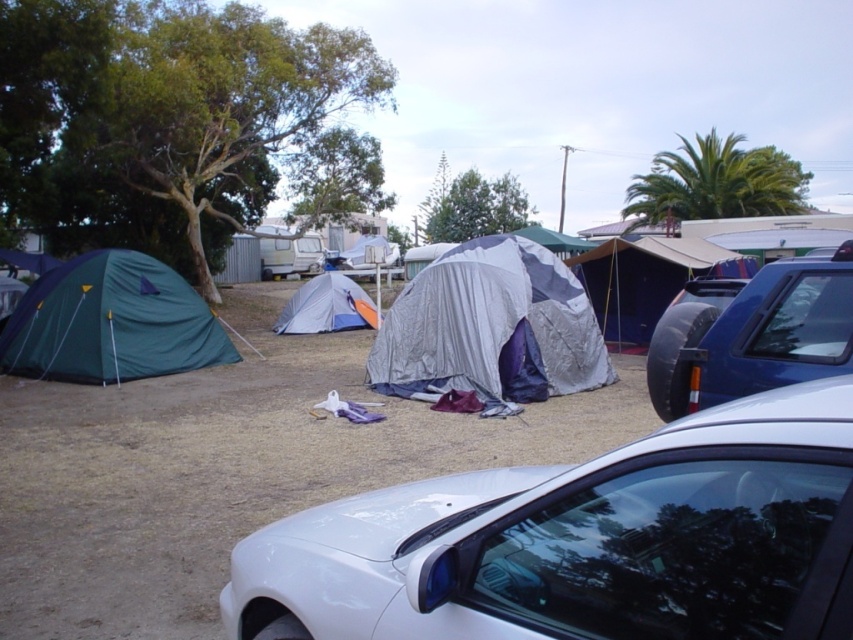
From the picture: Is green fabric tent at lower left to the right of blue metallic car at right from the viewer's perspective?

No, green fabric tent at lower left is not to the right of blue metallic car at right.

Which is more to the right, green fabric tent at lower left or blue metallic car at right?

blue metallic car at right

Find the location of a particular element. This screenshot has height=640, width=853. green fabric tent at lower left is located at coordinates (111, 323).

Is white glossy car at lower center positioned in front of green fabric tent at lower left?

Yes, it is.

I want to click on white glossy car at lower center, so click(584, 541).

Image resolution: width=853 pixels, height=640 pixels. What are the coordinates of `white glossy car at lower center` in the screenshot? It's located at (584, 541).

Who is more forward, (25, 467) or (97, 288)?

Positioned in front is point (25, 467).

Does brown dirt field at center have a greater width compared to green fabric tent at lower left?

Yes.

Where is `brown dirt field at center`? The image size is (853, 640). brown dirt field at center is located at coordinates (228, 470).

Locate an element on the screen. The height and width of the screenshot is (640, 853). brown dirt field at center is located at coordinates (228, 470).